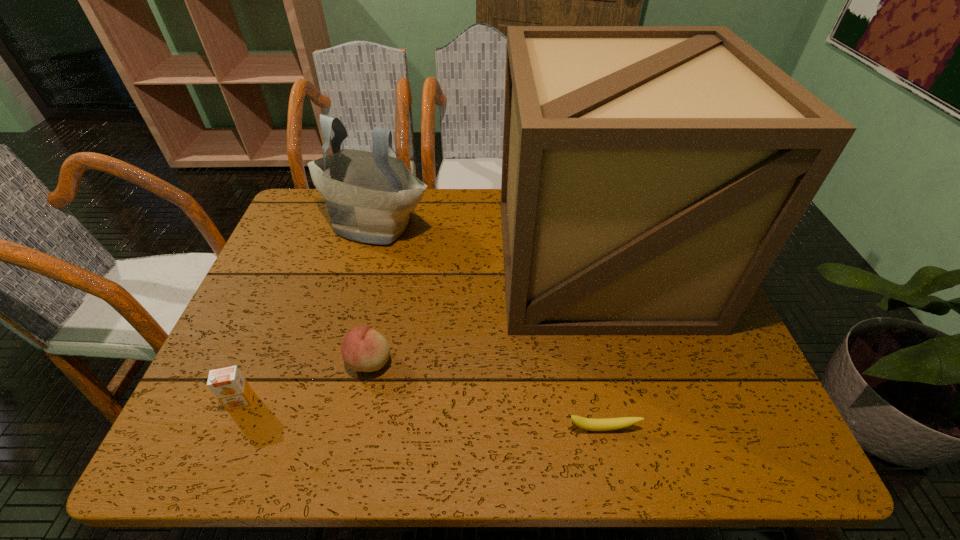
Where is `box that is at the far edge`? This screenshot has width=960, height=540. box that is at the far edge is located at coordinates (651, 175).

Identify the location of shopping bag at the far edge. The image size is (960, 540). (369, 195).

You are a GUI agent. You are given a task and a screenshot of the screen. Output one action in this format:
    pyautogui.click(x=<x>, y=<y>)
    Task: Click on the object that is at the near edge
    Image resolution: width=960 pixels, height=540 pixels.
    Given the screenshot: What is the action you would take?
    pyautogui.click(x=607, y=424)

Find the location of `shopping bag at the left edge`. shopping bag at the left edge is located at coordinates tap(369, 195).

You are a GUI agent. You are given a task and a screenshot of the screen. Output one action in this format:
    pyautogui.click(x=<x>, y=<y>)
    Task: Click on the orange juice positioned at the left edge
    The height and width of the screenshot is (540, 960).
    Given the screenshot: What is the action you would take?
    [x=228, y=384]

Where is `object that is at the right edge`? This screenshot has width=960, height=540. object that is at the right edge is located at coordinates (651, 175).

The image size is (960, 540). Identify the location of object that is at the far left corner. (369, 195).

Identify the location of object positioned at the far right corner. (651, 175).

Image resolution: width=960 pixels, height=540 pixels. In the image, there is a desktop. Find the location of `blank space at the far edge`. blank space at the far edge is located at coordinates (485, 235).

At what (x,y) coordinates should I click in order to perform the action: click on free space at the near edge of the desktop. Please return your answer as a coordinate pair (x, y). The height and width of the screenshot is (540, 960). Looking at the image, I should click on (636, 456).